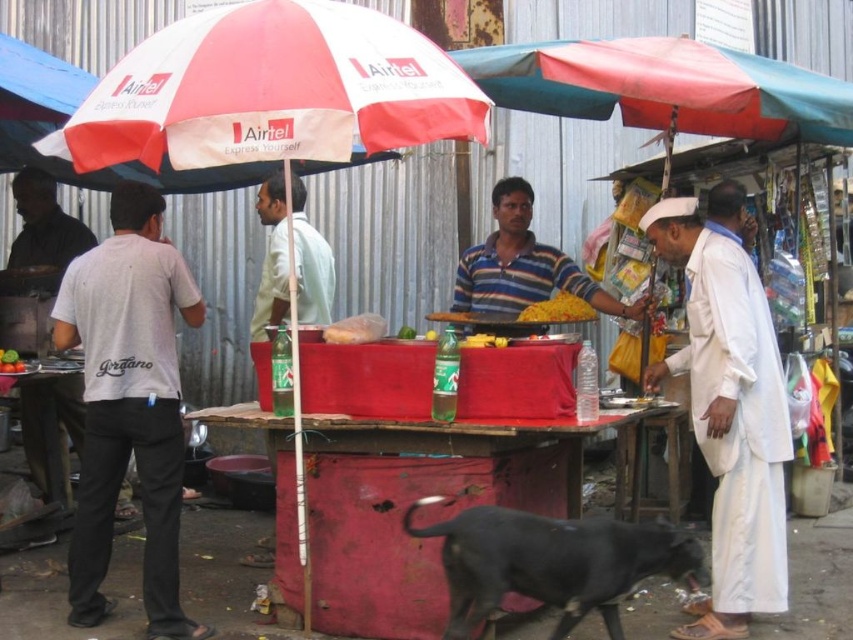
Between point (102, 394) and point (631, 316), which one is positioned in front?

Positioned in front is point (102, 394).

Is point (83, 259) less distant than point (473, 308)?

Yes, it is in front of point (473, 308).

The height and width of the screenshot is (640, 853). In order to click on white cotton t-shirt at left in this screenshot , I will do `click(129, 403)`.

Is white cotton shirt at center to the left of yellow matte corn at center from the viewer's perspective?

Incorrect, white cotton shirt at center is not on the left side of yellow matte corn at center.

Between point (659, 227) and point (572, 294), which one is positioned in front?

Point (659, 227)

Who is more distant from viewer, [722,624] or [560,316]?

Positioned behind is point [560,316].

Where is `white cotton shirt at center`? This screenshot has width=853, height=640. white cotton shirt at center is located at coordinates (729, 417).

Is striped cotton shirt at center thinner than yellow matte corn at center?

In fact, striped cotton shirt at center might be wider than yellow matte corn at center.

Is striped cotton shirt at center in front of yellow matte corn at center?

No, striped cotton shirt at center is behind yellow matte corn at center.

This screenshot has width=853, height=640. What do you see at coordinates (523, 264) in the screenshot?
I see `striped cotton shirt at center` at bounding box center [523, 264].

I want to click on striped cotton shirt at center, so click(x=523, y=264).